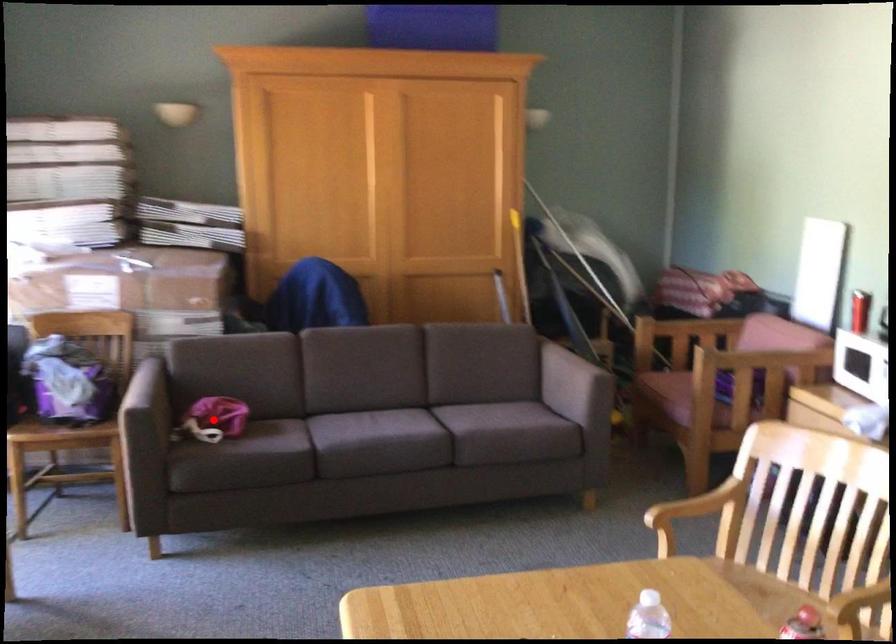
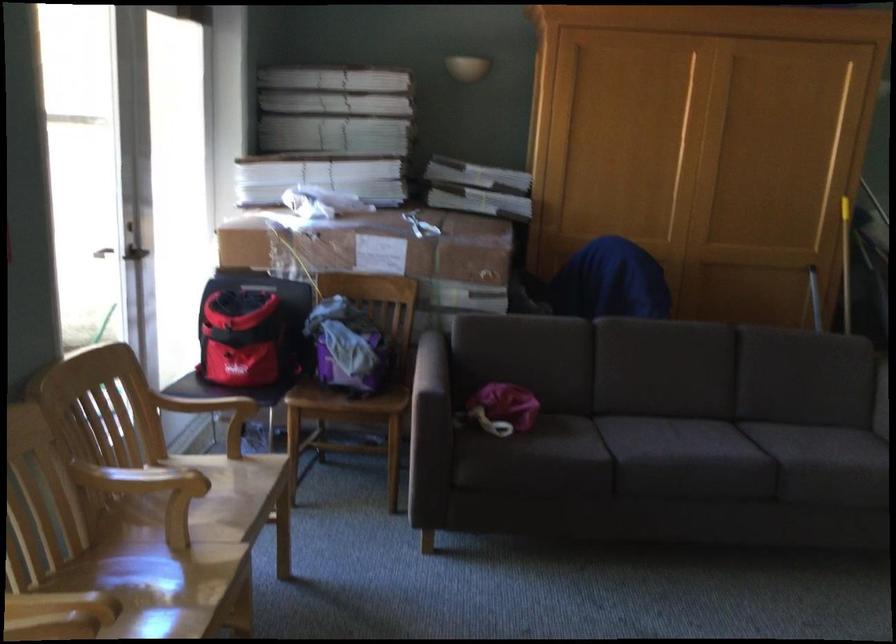
Question: I am providing you with two images of the same scene from different viewpoints. A red point is marked on the first image. Can you still see the location of the red point in image 2?

Choices:
 (A) Yes
 (B) No

Answer: (A)